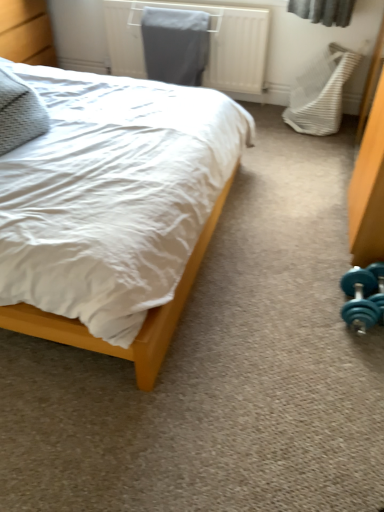
The image size is (384, 512). I want to click on vacant area situated to the left side of white textured swivel chair at right, so click(x=263, y=124).